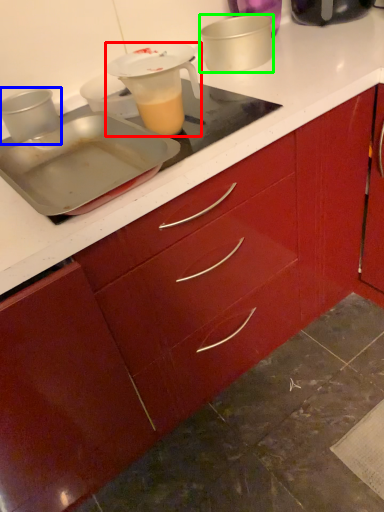
Question: Estimate the real-world distances between objects in this image. Which object is closer to jug (highlighted by a red box), kitchen appliance (highlighted by a blue box) or kitchen appliance (highlighted by a green box)?

Choices:
 (A) kitchen appliance
 (B) kitchen appliance

Answer: (A)